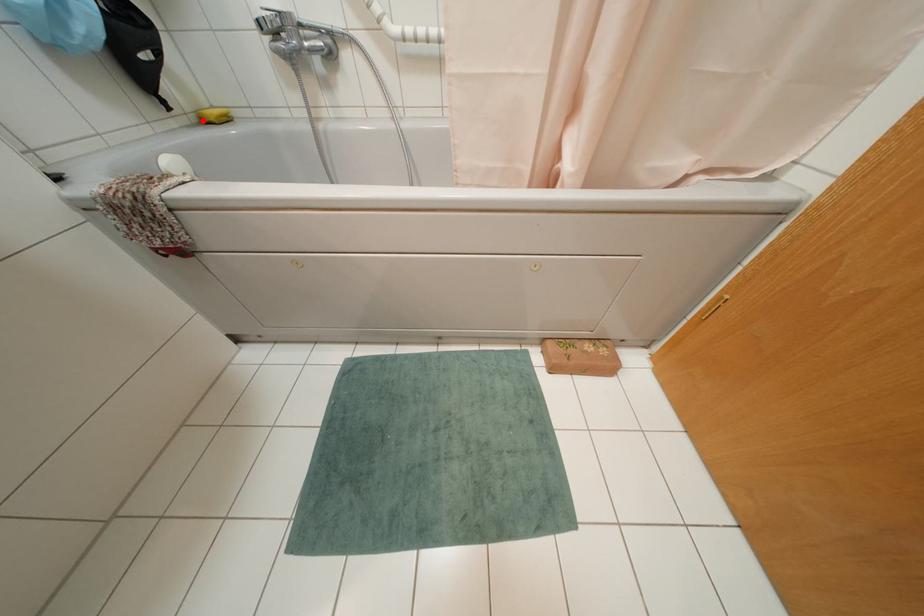
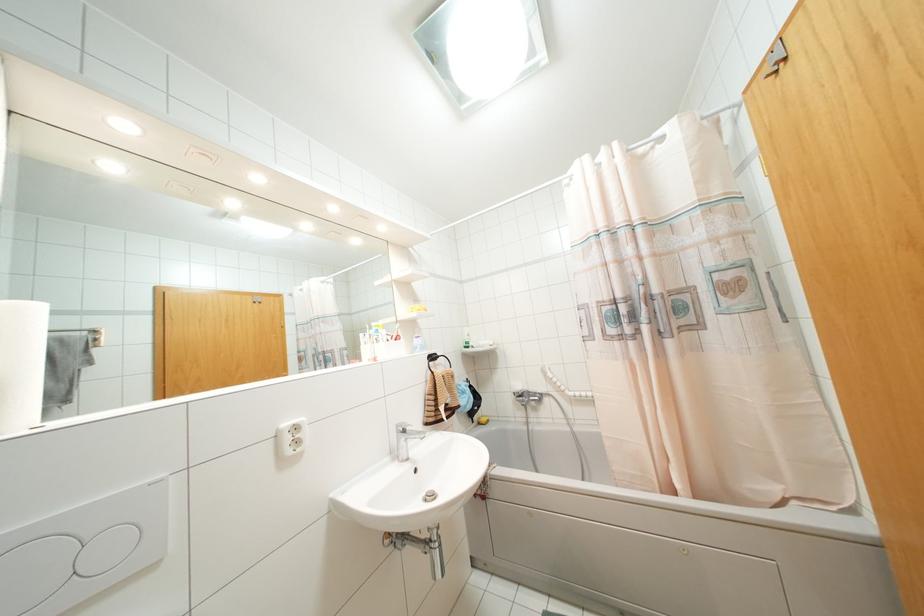
Where in the second image is the point corresponding to the highlighted location from the first image?

(479, 423)